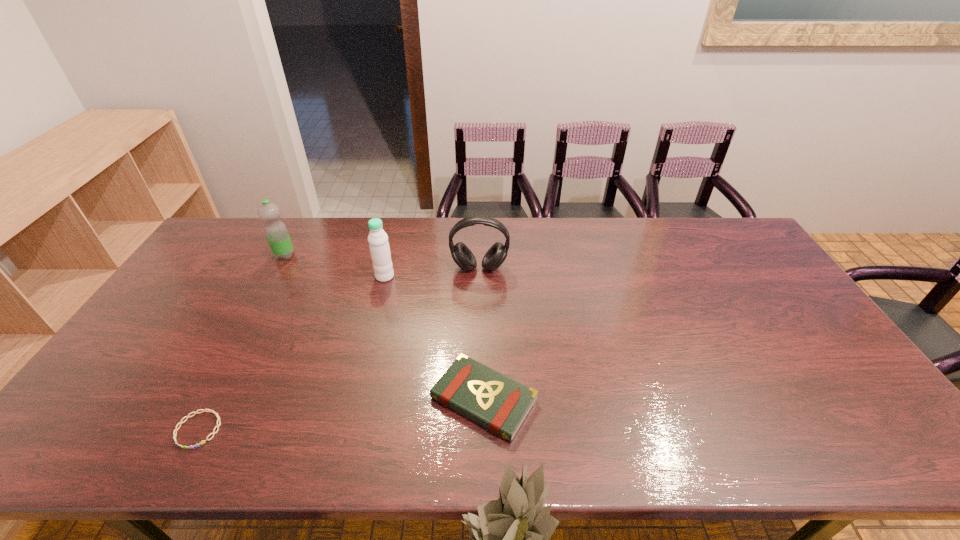
Where is `object located in the far edge section of the desktop`? The width and height of the screenshot is (960, 540). object located in the far edge section of the desktop is located at coordinates (276, 232).

Locate an element on the screen. book that is at the near edge is located at coordinates (493, 400).

Image resolution: width=960 pixels, height=540 pixels. Find the location of `bracelet located in the near edge section of the desktop`. bracelet located in the near edge section of the desktop is located at coordinates (216, 414).

This screenshot has width=960, height=540. I want to click on vacant space at the far edge of the desktop, so click(x=307, y=235).

Where is `free space at the near edge of the desktop`? This screenshot has height=540, width=960. free space at the near edge of the desktop is located at coordinates (215, 454).

This screenshot has height=540, width=960. I want to click on vacant space at the far right corner of the desktop, so click(742, 254).

Locate an element on the screen. The height and width of the screenshot is (540, 960). empty space between the farther water bottle and the shortest object is located at coordinates (242, 343).

At what (x,y) coordinates should I click in order to perform the action: click on free space between the right water bottle and the headset. Please return your answer as a coordinate pair (x, y). Looking at the image, I should click on (432, 272).

Identify the location of free spot between the bracelet and the headset. (339, 349).

Find the location of a particular element. This screenshot has width=960, height=540. vacant area that lies between the second shortest object and the farther water bottle is located at coordinates (384, 328).